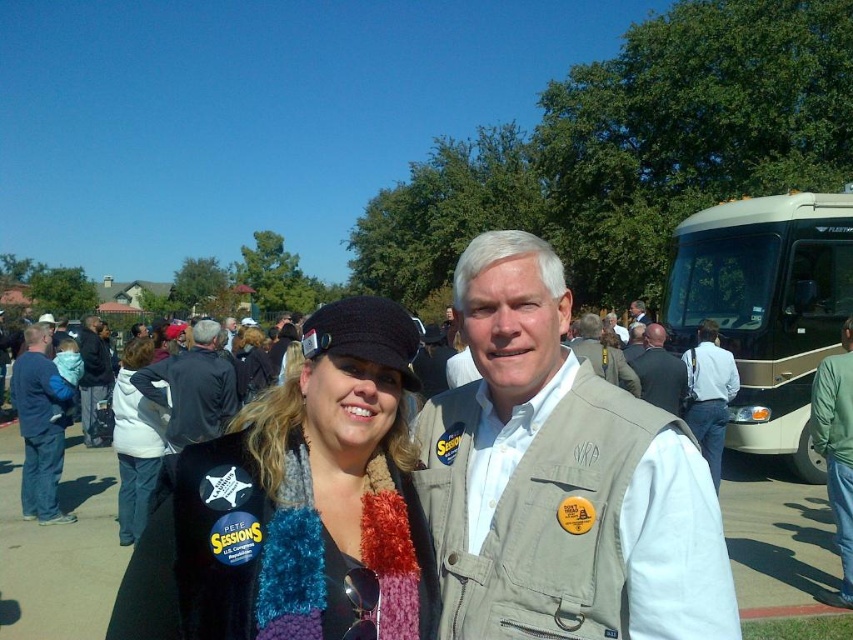
Question: Does khaki vest at center have a lesser width compared to light beige vest at center?

Choices:
 (A) yes
 (B) no

Answer: (A)

Question: Observing the image, what is the correct spatial positioning of knitted scarf at center in reference to gold metallic bus at right?

Choices:
 (A) left
 (B) right

Answer: (A)

Question: Which of these objects is positioned farthest from the light beige vest at center?

Choices:
 (A) white fleece jacket at lower left
 (B) tan fabric vest at center
 (C) khaki vest at center
 (D) beige vest at center

Answer: (B)

Question: Which point is farther to the camera?

Choices:
 (A) (137, 458)
 (B) (704, 285)
 (C) (705, 417)
 (D) (144, 390)

Answer: (B)

Question: Considering the real-world distances, which object is closest to the knitted scarf at center?

Choices:
 (A) blue denim jeans at left
 (B) gold metallic bus at right
 (C) dark blue jacket at center

Answer: (C)

Question: Is gold metallic bus at right positioned at the back of green fabric pants at lower right?

Choices:
 (A) yes
 (B) no

Answer: (A)